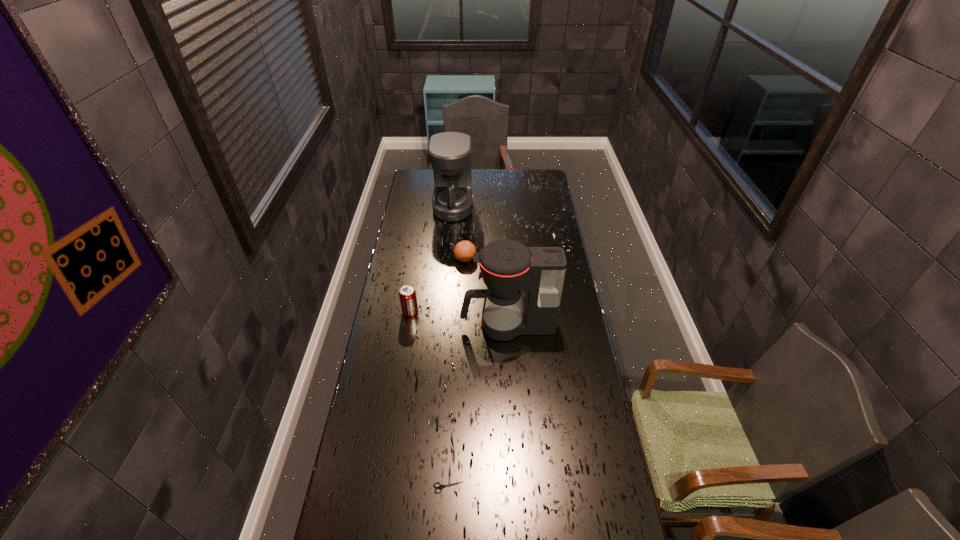
The image size is (960, 540). In the image, there is a desktop. What are the coordinates of `vacant space at the far left corner` in the screenshot? It's located at (415, 169).

Locate an element on the screen. vacant position at the far right corner of the desktop is located at coordinates (532, 188).

The width and height of the screenshot is (960, 540). Find the location of `empty space that is in between the shears and the soda can`. empty space that is in between the shears and the soda can is located at coordinates (429, 400).

You are a GUI agent. You are given a task and a screenshot of the screen. Output one action in this format:
    pyautogui.click(x=<x>, y=<y>)
    Task: Click on the free spot between the third tallest object and the farthest object
    Image resolution: width=960 pixels, height=540 pixels.
    Given the screenshot: What is the action you would take?
    pyautogui.click(x=432, y=260)

Find the location of `free space between the nearer coffee maker and the third tallest object`. free space between the nearer coffee maker and the third tallest object is located at coordinates (459, 319).

This screenshot has height=540, width=960. In order to click on vacant space that's between the nearer coffee maker and the shears in this screenshot , I will do `click(478, 407)`.

Find the location of a particular element. This screenshot has height=540, width=960. vacant space that's between the soda can and the nearest object is located at coordinates (429, 400).

Locate an element on the screen. The height and width of the screenshot is (540, 960). free spot between the shortest object and the nearer coffee maker is located at coordinates (478, 407).

Identify the location of free area in between the soda can and the second farthest object. Image resolution: width=960 pixels, height=540 pixels. (438, 285).

Identify the location of vacant region between the shortest object and the leftmost object. (429, 400).